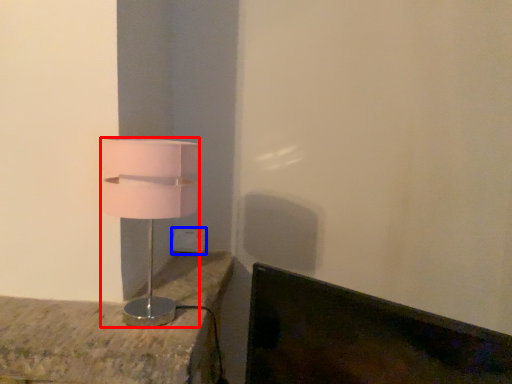
Question: Which object is further to the camera taking this photo, lamp (highlighted by a red box) or electric outlet (highlighted by a blue box)?

Choices:
 (A) lamp
 (B) electric outlet

Answer: (B)